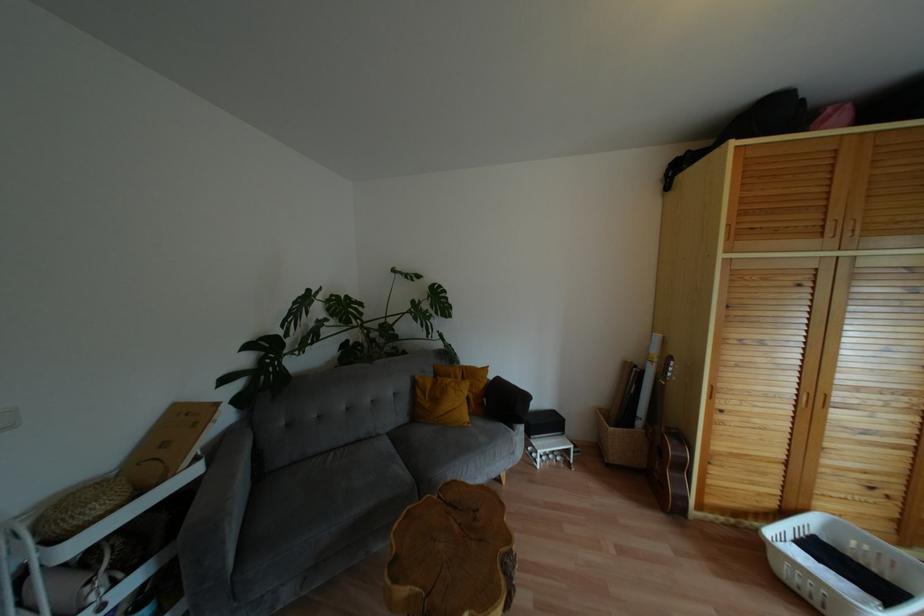
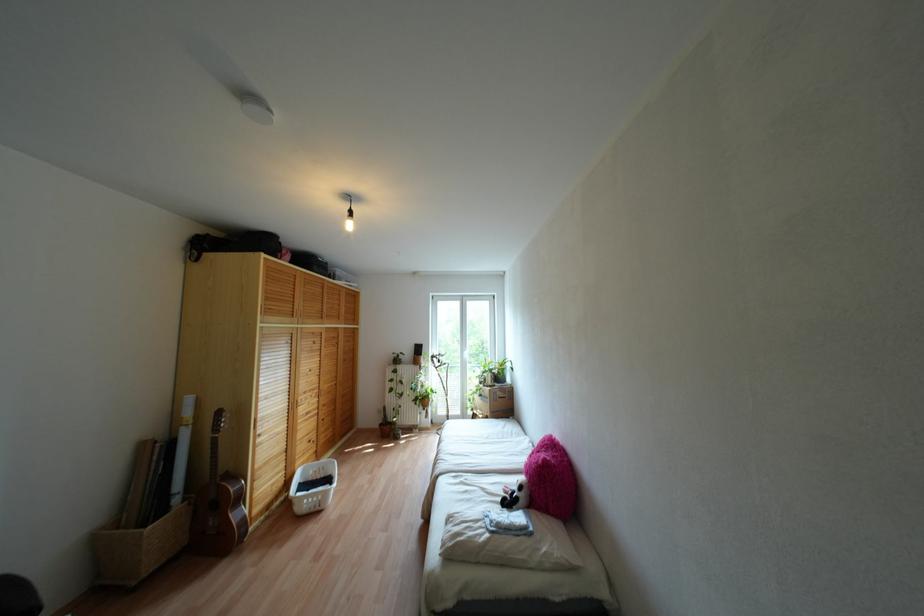
In the second image, find the point that corresponds to (x=708, y=480) in the first image.

(253, 495)